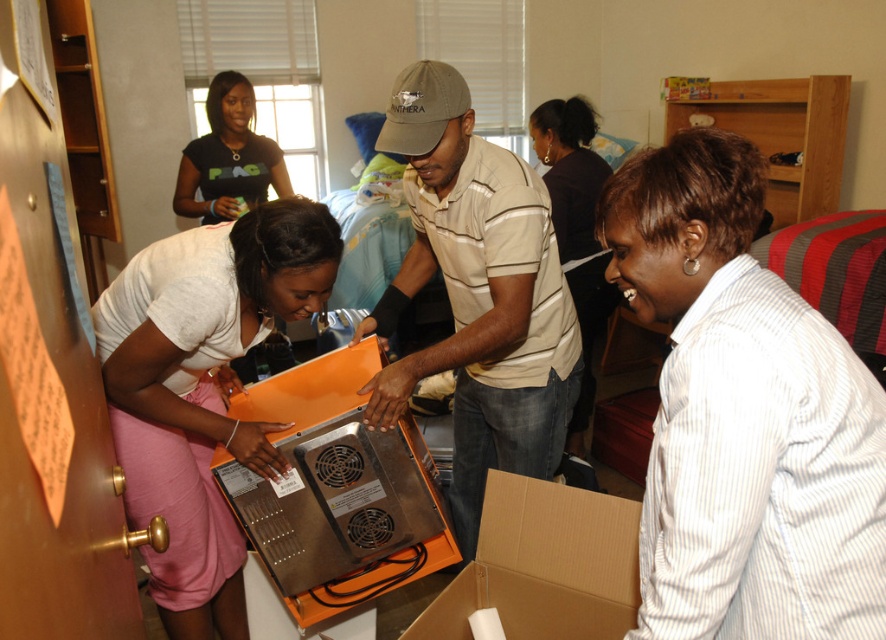
Can you confirm if white striped shirt at lower right is thinner than matte white shirt at left?

Yes.

Who is more distant from viewer, (709, 433) or (187, 404)?

The point (187, 404) is more distant.

Between point (703, 355) and point (130, 424), which one is positioned behind?

Positioned behind is point (130, 424).

At what (x,y) coordinates should I click in order to perform the action: click on white striped shirt at lower right. Please return your answer as a coordinate pair (x, y). Looking at the image, I should click on (743, 416).

This screenshot has height=640, width=886. What do you see at coordinates (543, 564) in the screenshot?
I see `cardboard at lower center` at bounding box center [543, 564].

Does point (543, 618) come farther from viewer compared to point (554, 166)?

No, it is not.

The image size is (886, 640). I want to click on cardboard at lower center, so click(x=543, y=564).

Between point (131, 355) and point (607, 625), which one is positioned behind?

Positioned behind is point (607, 625).

Where is `matte white shirt at left`? The height and width of the screenshot is (640, 886). matte white shirt at left is located at coordinates (201, 388).

What are the coordinates of `matte white shirt at left` in the screenshot? It's located at (201, 388).